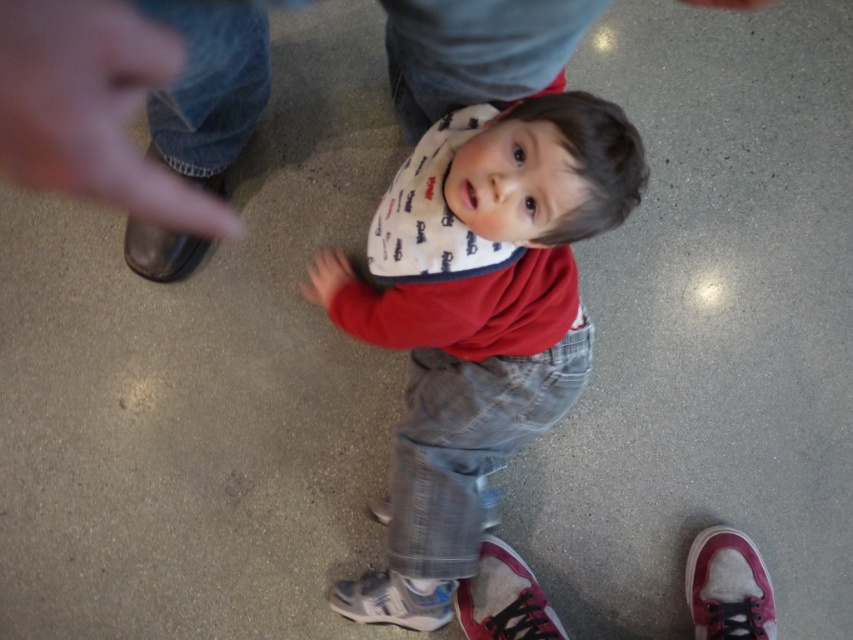
Between matte red shirt at center and white textured sneaker at lower center, which one appears on the left side from the viewer's perspective?

white textured sneaker at lower center

Between point (428, 484) and point (367, 600), which one is positioned in front?

Point (428, 484) is in front.

Find the location of `matte red shirt at center`. matte red shirt at center is located at coordinates (485, 301).

Who is shorter, white canvas shoe at lower right or matte red hand at center?

With less height is matte red hand at center.

Looking at this image, does white canvas shoe at lower right appear on the left side of matte red hand at center?

No, white canvas shoe at lower right is not to the left of matte red hand at center.

Is point (740, 568) farther from camera compared to point (328, 301)?

Yes, point (740, 568) is behind point (328, 301).

Identify the location of white canvas shoe at lower right. (728, 586).

Which of these two, white textured sneaker at lower center or brown leather shoe at upper left, stands taller?

brown leather shoe at upper left is taller.

Identify the location of white textured sneaker at lower center. This screenshot has width=853, height=640. (392, 600).

The image size is (853, 640). Find the location of `white textured sneaker at lower center`. white textured sneaker at lower center is located at coordinates (392, 600).